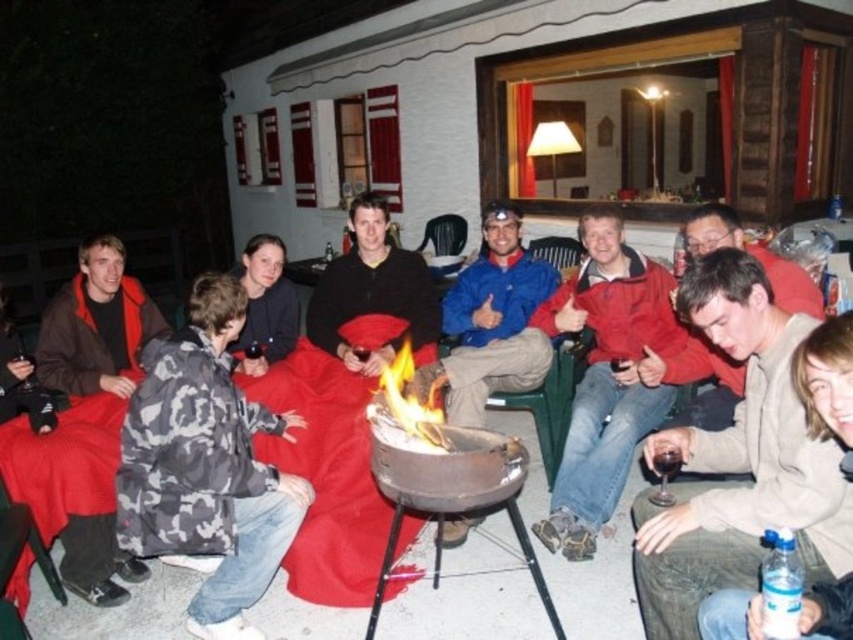
You are a photographer standing at the edge of the patio, wanting to take a group photo of the people around the fire pit. You notice the light brown leather jacket at lower right and the matte black jacket at center. Which jacket should you focus on first to ensure it appears larger in the photo?

The light brown leather jacket at lower right is taller than the matte black jacket at center, so focusing on it first will ensure it appears larger in the photo.

You are a photographer trying to capture a clear shot of both the light brown leather jacket at lower right and the camouflage jacket at center. Since the camera has a limited depth of field, you need to focus on the closer object first. Which jacket should you focus on first?

The light brown leather jacket at lower right is thinner than the camouflage jacket at center, so it is closer to the camera. Therefore, you should focus on the light brown leather jacket at lower right first to ensure it is in sharp focus before adjusting for the camouflage jacket at center.

You are a photographer trying to capture a clear image of both the light brown leather jacket at lower right and the matte black jacket at center. Since the fire pit is the brightest part of the scene, which jacket might require a different exposure setting to ensure it isn t underexposed?

The matte black jacket at center might require a different exposure setting because it is thicker and could absorb more light, making it appear darker in the photo compared to the lighter, thinner light brown leather jacket at lower right.